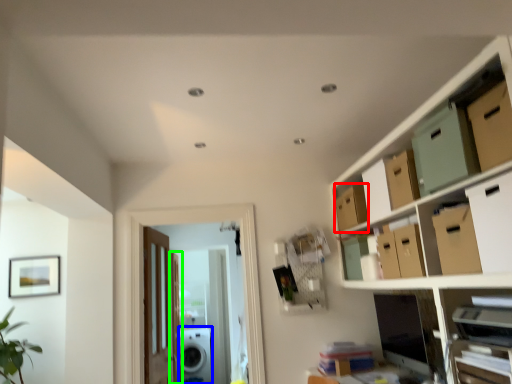
Question: Based on their relative distances, which object is farther from storage box (highlighted by a red box)? Choose from appliance (highlighted by a blue box) and door (highlighted by a green box).

Choices:
 (A) appliance
 (B) door

Answer: (A)